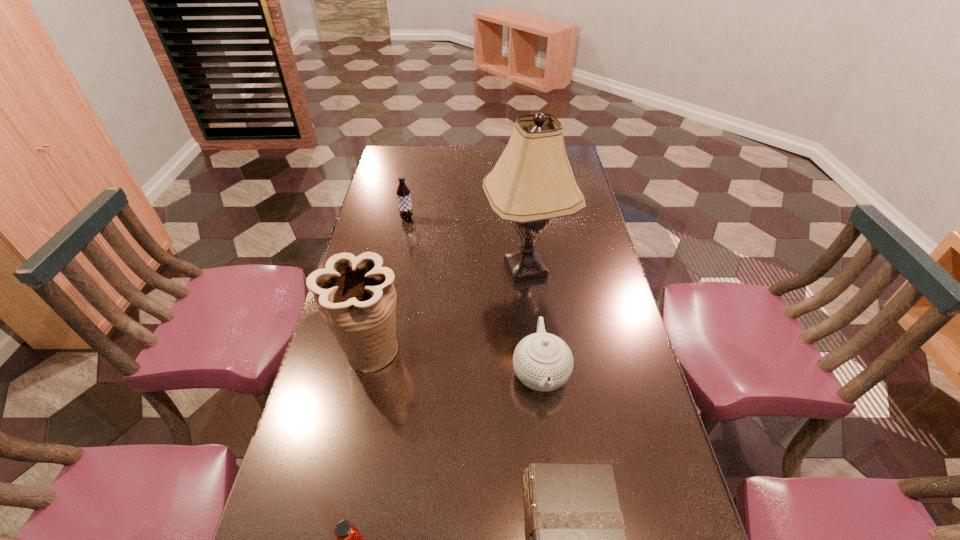
Find the location of `lamp`. lamp is located at coordinates (532, 182).

Find the location of a particular element. The height and width of the screenshot is (540, 960). the tallest object is located at coordinates [x=532, y=182].

This screenshot has width=960, height=540. What are the coordinates of `the second tallest object` in the screenshot? It's located at (356, 297).

At what (x,y) coordinates should I click in order to perform the action: click on the farthest object. Please return your answer as a coordinate pair (x, y). The height and width of the screenshot is (540, 960). Looking at the image, I should click on (403, 193).

This screenshot has height=540, width=960. In order to click on root beer in this screenshot , I will do `click(403, 193)`.

The height and width of the screenshot is (540, 960). What are the coordinates of `the fourth tallest object` in the screenshot? It's located at (542, 361).

At what (x,y) coordinates should I click in order to perform the action: click on vacant space located 0.300m on the left of the tallest object. Please return your answer as a coordinate pair (x, y). Looking at the image, I should click on (389, 269).

Where is `vacant space located on the front of the second tallest object`? vacant space located on the front of the second tallest object is located at coordinates (355, 416).

You are a GUI agent. You are given a task and a screenshot of the screen. Output one action in this format:
    pyautogui.click(x=<x>, y=<y>)
    Task: Click on the vacant region located 0.130m on the left of the root beer
    The image size is (960, 540).
    Given the screenshot: What is the action you would take?
    pyautogui.click(x=365, y=219)

Locate an element on the screen. Image resolution: width=960 pixels, height=540 pixels. vacant space located 0.140m on the spout of the chinaware is located at coordinates (551, 467).